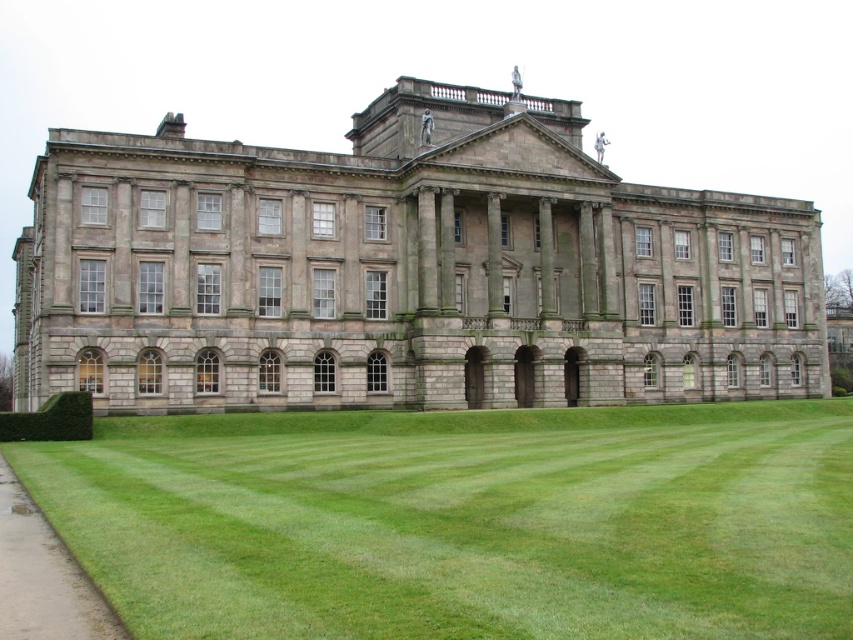
Question: Among these points, which one is nearest to the camera?

Choices:
 (A) click(x=358, y=252)
 (B) click(x=215, y=508)

Answer: (B)

Question: Is gray stone palace at center to the right of green grass at lower center from the viewer's perspective?

Choices:
 (A) yes
 (B) no

Answer: (B)

Question: Does gray stone palace at center lie behind green grass at lower center?

Choices:
 (A) yes
 (B) no

Answer: (A)

Question: Among these points, which one is farthest from the camera?

Choices:
 (A) (811, 586)
 (B) (532, 336)

Answer: (B)

Question: Is gray stone palace at center positioned before green grass at lower center?

Choices:
 (A) no
 (B) yes

Answer: (A)